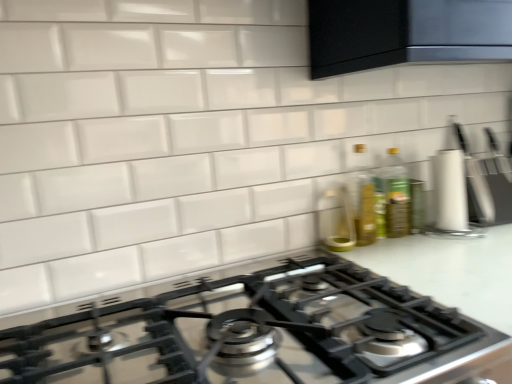
Question: From the image's perspective, is translucent glass bottle at right, placed as the 2th bottle when sorted from right to left, under satin black gas stove at center?

Choices:
 (A) no
 (B) yes

Answer: (A)

Question: Is translucent glass bottle at right, placed as the 2th bottle when sorted from right to left, outside satin black gas stove at center?

Choices:
 (A) no
 (B) yes

Answer: (B)

Question: From a real-world perspective, is translucent glass bottle at right, placed as the 2th bottle when sorted from right to left, physically above satin black gas stove at center?

Choices:
 (A) yes
 (B) no

Answer: (A)

Question: Are translucent glass bottle at right, placed as the 2th bottle when sorted from right to left, and satin black gas stove at center making contact?

Choices:
 (A) no
 (B) yes

Answer: (A)

Question: Is translucent glass bottle at right, placed as the 2th bottle when sorted from right to left, to the left of satin black gas stove at center from the viewer's perspective?

Choices:
 (A) yes
 (B) no

Answer: (B)

Question: From a real-world perspective, is translucent glass bottle at right, placed as the 2th bottle when sorted from right to left, under satin black gas stove at center?

Choices:
 (A) no
 (B) yes

Answer: (A)

Question: Is green glass bottle at upper right, which is counted as the 1th bottle, starting from the right, not near satin black gas stove at center?

Choices:
 (A) no
 (B) yes

Answer: (A)

Question: Does green glass bottle at upper right, which ranks as the second bottle in left-to-right order, have a lesser width compared to satin black gas stove at center?

Choices:
 (A) yes
 (B) no

Answer: (A)

Question: Can you confirm if green glass bottle at upper right, which ranks as the second bottle in left-to-right order, is shorter than satin black gas stove at center?

Choices:
 (A) yes
 (B) no

Answer: (B)

Question: Is green glass bottle at upper right, which ranks as the second bottle in left-to-right order, outside satin black gas stove at center?

Choices:
 (A) yes
 (B) no

Answer: (A)

Question: From a real-world perspective, is green glass bottle at upper right, which is counted as the 1th bottle, starting from the right, over satin black gas stove at center?

Choices:
 (A) no
 (B) yes

Answer: (B)

Question: From a real-world perspective, is green glass bottle at upper right, which is counted as the 1th bottle, starting from the right, positioned under satin black gas stove at center based on gravity?

Choices:
 (A) no
 (B) yes

Answer: (A)

Question: Is green glass bottle at upper right, which is counted as the 1th bottle, starting from the right, bigger than white glossy countertop at center?

Choices:
 (A) yes
 (B) no

Answer: (B)